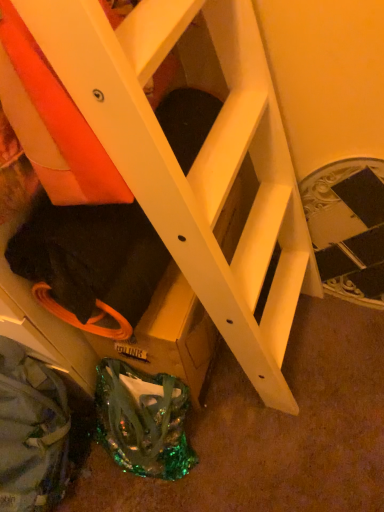
Question: Is shiny green fabric bag at lower center with black textured stairwell at center?

Choices:
 (A) no
 (B) yes

Answer: (A)

Question: Considering the relative positions of shiny green fabric bag at lower center and black textured stairwell at center in the image provided, is shiny green fabric bag at lower center in front of black textured stairwell at center?

Choices:
 (A) yes
 (B) no

Answer: (A)

Question: Is shiny green fabric bag at lower center turned away from black textured stairwell at center?

Choices:
 (A) no
 (B) yes

Answer: (A)

Question: From a real-world perspective, is shiny green fabric bag at lower center under black textured stairwell at center?

Choices:
 (A) yes
 (B) no

Answer: (A)

Question: Does shiny green fabric bag at lower center have a lesser width compared to black textured stairwell at center?

Choices:
 (A) yes
 (B) no

Answer: (B)

Question: From a real-world perspective, does shiny green fabric bag at lower center stand above black textured stairwell at center?

Choices:
 (A) no
 (B) yes

Answer: (A)

Question: Is black textured stairwell at center thinner than shiny green fabric bag at lower center?

Choices:
 (A) no
 (B) yes

Answer: (B)

Question: Would you consider black textured stairwell at center to be distant from shiny green fabric bag at lower center?

Choices:
 (A) no
 (B) yes

Answer: (A)

Question: From a real-world perspective, is black textured stairwell at center on top of shiny green fabric bag at lower center?

Choices:
 (A) yes
 (B) no

Answer: (A)

Question: Is black textured stairwell at center directly adjacent to shiny green fabric bag at lower center?

Choices:
 (A) no
 (B) yes

Answer: (A)

Question: Can you confirm if black textured stairwell at center is taller than shiny green fabric bag at lower center?

Choices:
 (A) yes
 (B) no

Answer: (A)

Question: Considering the relative sizes of black textured stairwell at center and shiny green fabric bag at lower center in the image provided, is black textured stairwell at center wider than shiny green fabric bag at lower center?

Choices:
 (A) no
 (B) yes

Answer: (A)

Question: Which is correct: black textured stairwell at center is inside shiny green fabric bag at lower center, or outside of it?

Choices:
 (A) outside
 (B) inside

Answer: (A)